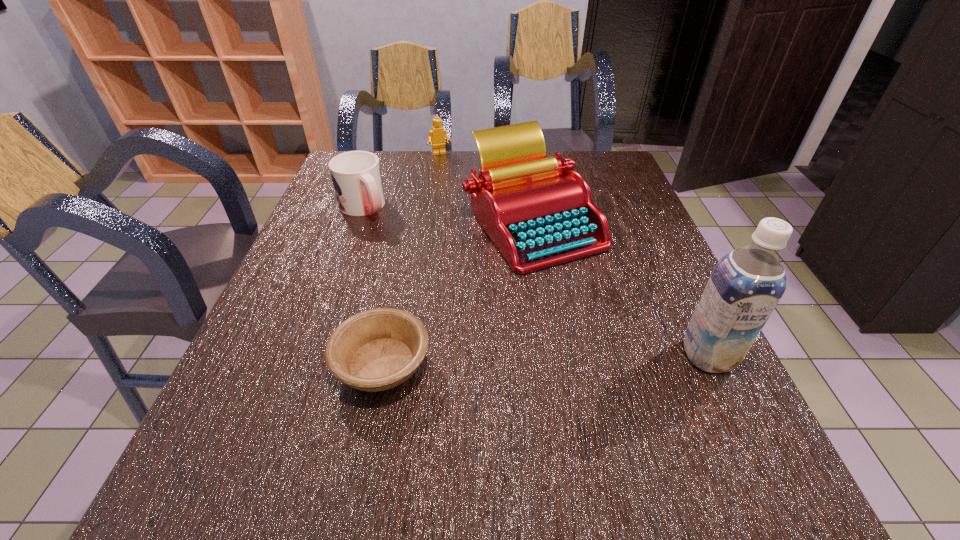
Locate an element on the screen. Image resolution: width=960 pixels, height=540 pixels. vacant region at the near left corner of the desktop is located at coordinates tap(234, 403).

Where is `free space at the far right corner of the desktop`? This screenshot has width=960, height=540. free space at the far right corner of the desktop is located at coordinates (609, 153).

At what (x,y) coordinates should I click in order to perform the action: click on blank space at the near right corner. Please return your answer as a coordinate pair (x, y). Looking at the image, I should click on (756, 432).

Where is `vacant area between the shortest object and the fourth object from left to right`? This screenshot has width=960, height=540. vacant area between the shortest object and the fourth object from left to right is located at coordinates (457, 293).

The image size is (960, 540). Identify the location of free space between the mug and the shortest object. (372, 286).

Locate an element on the screen. vacant region between the fourth shortest object and the mug is located at coordinates (447, 215).

The width and height of the screenshot is (960, 540). I want to click on free space between the bowl and the soya milk, so click(x=545, y=360).

At what (x,y) coordinates should I click in order to perform the action: click on unoccupied position between the tallest object and the bowl. Please return your answer as a coordinate pair (x, y). This screenshot has width=960, height=540. Looking at the image, I should click on (545, 360).

This screenshot has width=960, height=540. I want to click on vacant point located between the rightmost object and the mug, so click(x=536, y=281).

Locate an element on the screen. The image size is (960, 540). vacant point located between the tallest object and the fourth object from left to right is located at coordinates (620, 289).